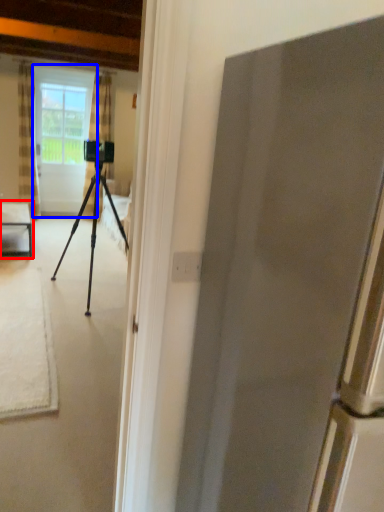
Question: Which of the following is the farthest to the observer, table (highlighted by a red box) or screen door (highlighted by a blue box)?

Choices:
 (A) table
 (B) screen door

Answer: (B)